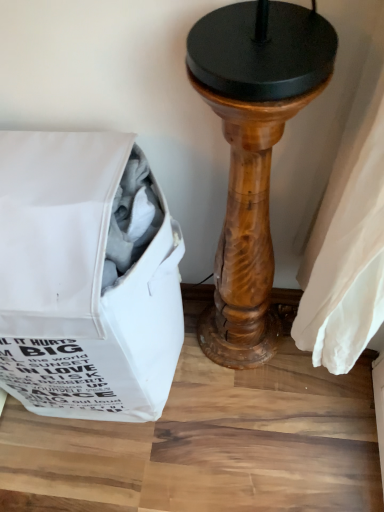
Question: Do you think wooden pedestal at center is within white fabric bag at left, or outside of it?

Choices:
 (A) outside
 (B) inside

Answer: (A)

Question: Based on their sizes in the image, would you say wooden pedestal at center is bigger or smaller than white fabric bag at left?

Choices:
 (A) small
 (B) big

Answer: (A)

Question: Considering the positions of point (215, 305) and point (72, 198), is point (215, 305) closer or farther from the camera than point (72, 198)?

Choices:
 (A) closer
 (B) farther

Answer: (B)

Question: In terms of size, does white fabric bag at left appear bigger or smaller than wooden pedestal at center?

Choices:
 (A) small
 (B) big

Answer: (B)

Question: From a real-world perspective, is white fabric bag at left above or below wooden pedestal at center?

Choices:
 (A) above
 (B) below

Answer: (B)

Question: Is white fabric bag at left in front of or behind wooden pedestal at center in the image?

Choices:
 (A) front
 (B) behind

Answer: (B)

Question: Is white fabric bag at left inside or outside of wooden pedestal at center?

Choices:
 (A) outside
 (B) inside

Answer: (A)